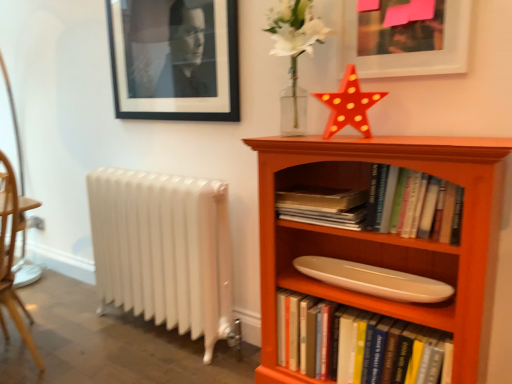
Find the location of `blank space to the left of white metallic radiator at lower left`. blank space to the left of white metallic radiator at lower left is located at coordinates (83, 326).